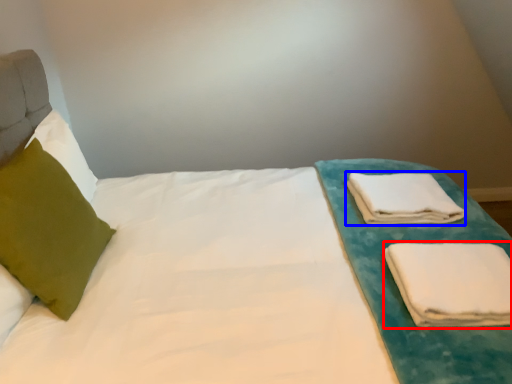
Question: Which object appears farthest to the camera in this image, cloth (highlighted by a red box) or cloth (highlighted by a blue box)?

Choices:
 (A) cloth
 (B) cloth

Answer: (B)